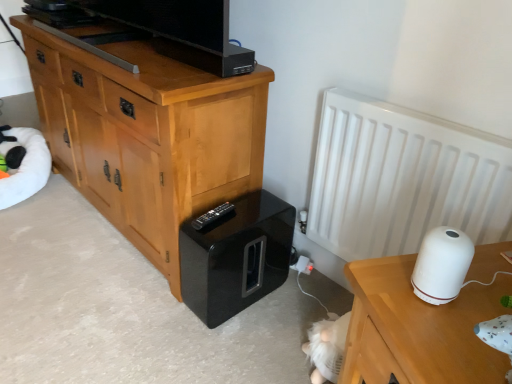
Question: Is glossy black speaker at lower center at the left side of white matte table at right?

Choices:
 (A) yes
 (B) no

Answer: (A)

Question: Can you confirm if glossy black speaker at lower center is taller than white matte table at right?

Choices:
 (A) yes
 (B) no

Answer: (B)

Question: Could you tell me if glossy black speaker at lower center is turned towards white matte table at right?

Choices:
 (A) yes
 (B) no

Answer: (B)

Question: Does glossy black speaker at lower center lie in front of white matte table at right?

Choices:
 (A) yes
 (B) no

Answer: (B)

Question: From a real-world perspective, is glossy black speaker at lower center located beneath white matte table at right?

Choices:
 (A) no
 (B) yes

Answer: (B)

Question: Is glossy black speaker at lower center taller or shorter than white matte table at right?

Choices:
 (A) tall
 (B) short

Answer: (B)

Question: Considering the positions of point (257, 213) and point (412, 261), is point (257, 213) closer or farther from the camera than point (412, 261)?

Choices:
 (A) closer
 (B) farther

Answer: (B)

Question: Considering the positions of glossy black speaker at lower center and white matte table at right in the image, is glossy black speaker at lower center bigger or smaller than white matte table at right?

Choices:
 (A) small
 (B) big

Answer: (A)

Question: Would you say glossy black speaker at lower center is to the left or to the right of white matte table at right in the picture?

Choices:
 (A) right
 (B) left

Answer: (B)

Question: In terms of width, does light brown wood chest of drawers at left look wider or thinner when compared to black plastic remote at lower center?

Choices:
 (A) thin
 (B) wide

Answer: (B)

Question: From the image's perspective, is light brown wood chest of drawers at left positioned above or below black plastic remote at lower center?

Choices:
 (A) below
 (B) above

Answer: (B)

Question: Considering the positions of light brown wood chest of drawers at left and black plastic remote at lower center in the image, is light brown wood chest of drawers at left bigger or smaller than black plastic remote at lower center?

Choices:
 (A) small
 (B) big

Answer: (B)

Question: From a real-world perspective, is light brown wood chest of drawers at left above or below black plastic remote at lower center?

Choices:
 (A) above
 (B) below

Answer: (A)

Question: Choose the correct answer: Is white glossy humidifier at right inside light brown wood chest of drawers at left or outside it?

Choices:
 (A) inside
 (B) outside

Answer: (B)

Question: From a real-world perspective, relative to light brown wood chest of drawers at left, is white glossy humidifier at right vertically above or below?

Choices:
 (A) above
 (B) below

Answer: (A)